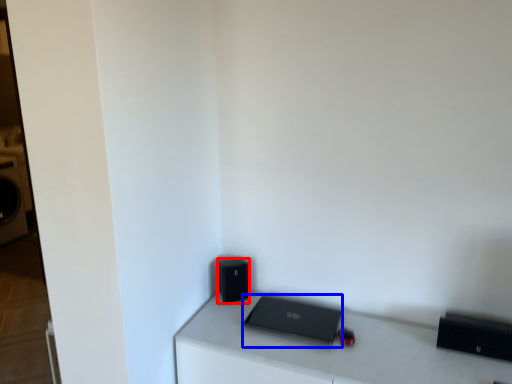
Question: Which object appears closest to the camera in this image, speaker (highlighted by a red box) or laptop (highlighted by a blue box)?

Choices:
 (A) speaker
 (B) laptop

Answer: (B)